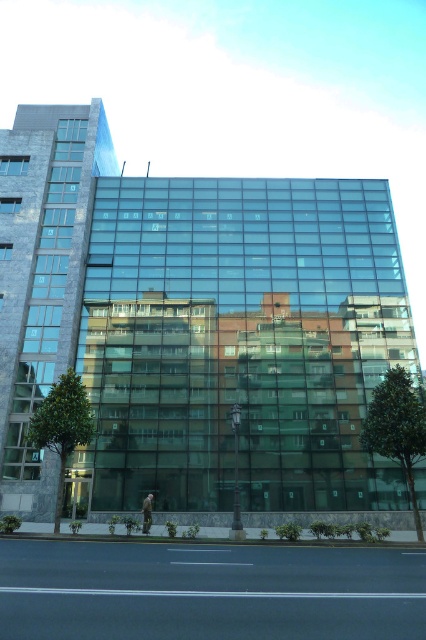
Question: Is green leafy tree at center to the left of green leafy tree at lower left from the viewer's perspective?

Choices:
 (A) yes
 (B) no

Answer: (B)

Question: Is green leafy tree at center closer to camera compared to green leafy tree at lower left?

Choices:
 (A) yes
 (B) no

Answer: (B)

Question: Is green leafy tree at center below green leafy tree at lower left?

Choices:
 (A) yes
 (B) no

Answer: (A)

Question: Among these points, which one is farthest from the camera?

Choices:
 (A) (48, 420)
 (B) (394, 438)

Answer: (A)